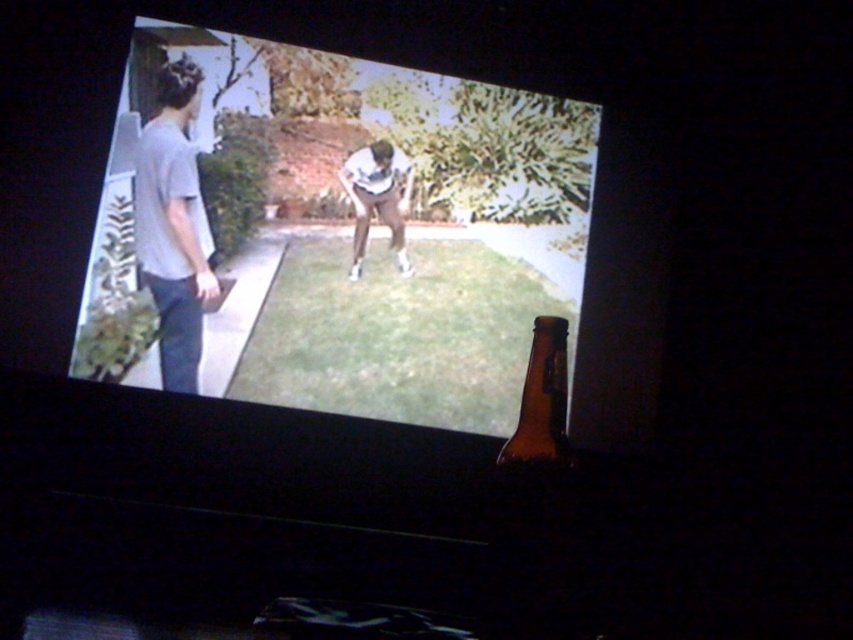
You are a security camera in the room. You see a point at coordinate (173, 225) on the gray cotton t shirt at left. What object is this point located on?

The point at coordinate (173, 225) is located on the gray cotton t shirt at left.

You are standing in the room looking at the projection screen. There are two points marked on the screen at coordinates point [502,467] and point [373,198]. Which point is closer to you?

Point [502,467] is closer to the camera than point [373,198], so it is closer to you.